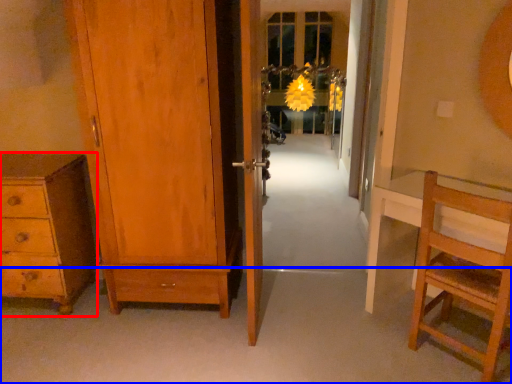
Question: Which of the following is the farthest to the observer, chest of drawers (highlighted by a red box) or path (highlighted by a blue box)?

Choices:
 (A) chest of drawers
 (B) path

Answer: (A)